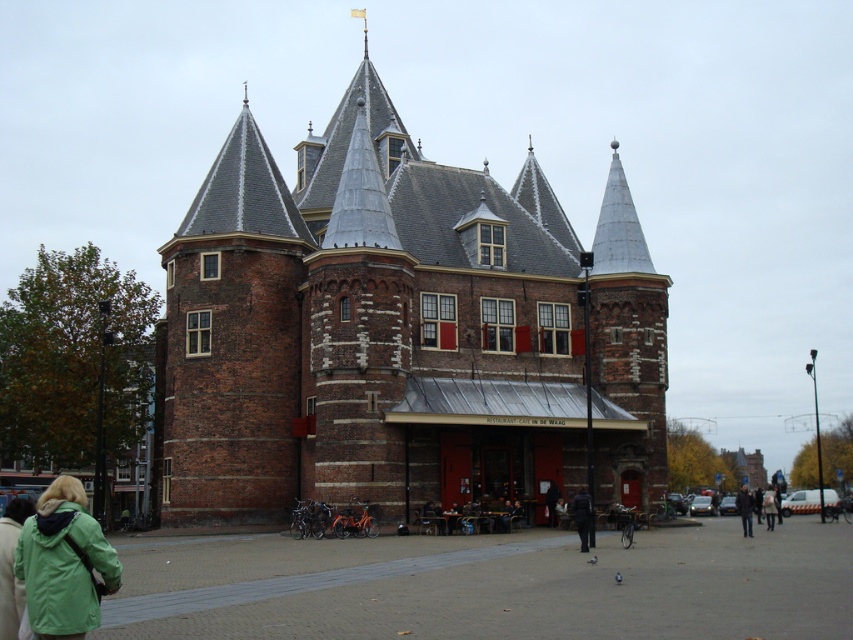
Question: Can you confirm if green matte jacket at lower left is positioned to the right of light brown leather jacket at center?

Choices:
 (A) yes
 (B) no

Answer: (B)

Question: Among these objects, which one is farthest from the camera?

Choices:
 (A) light brown leather jacket at center
 (B) dark brown leather jacket at center

Answer: (A)

Question: Which of the following is the farthest from the observer?

Choices:
 (A) green matte jacket at lower left
 (B) dark brown leather jacket at lower right
 (C) dark brown leather jacket at center
 (D) brick building at center

Answer: (B)

Question: Does brick building at center come behind green matte jacket at lower left?

Choices:
 (A) no
 (B) yes

Answer: (B)

Question: Which of the following is the closest to the observer?

Choices:
 (A) dark brown leather jacket at center
 (B) light brown leather jacket at center

Answer: (A)

Question: Is brick building at center positioned in front of green matte jacket at lower left?

Choices:
 (A) yes
 (B) no

Answer: (B)